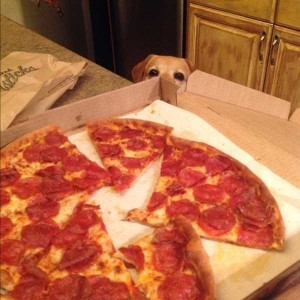
Where is `door handle`? Image resolution: width=300 pixels, height=300 pixels. door handle is located at coordinates (260, 51).